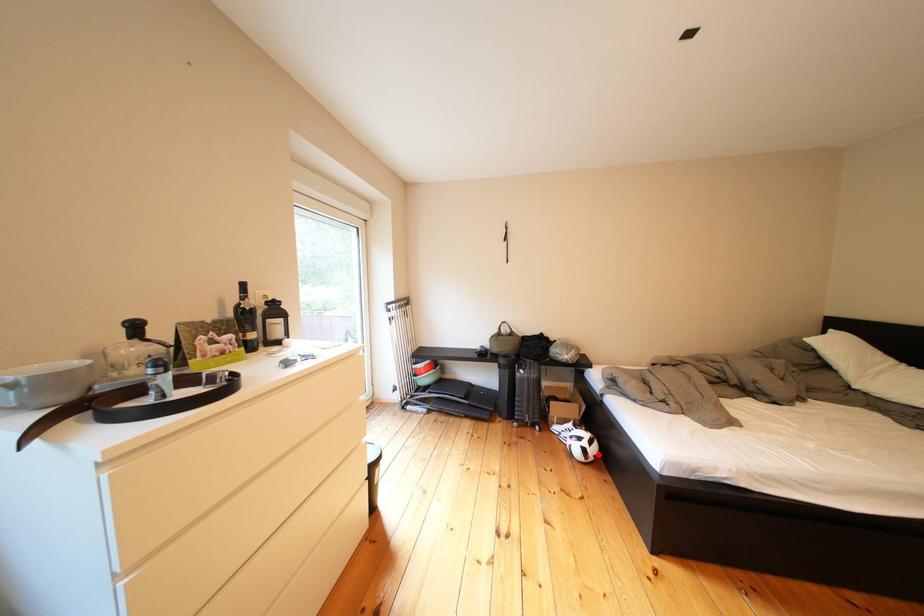
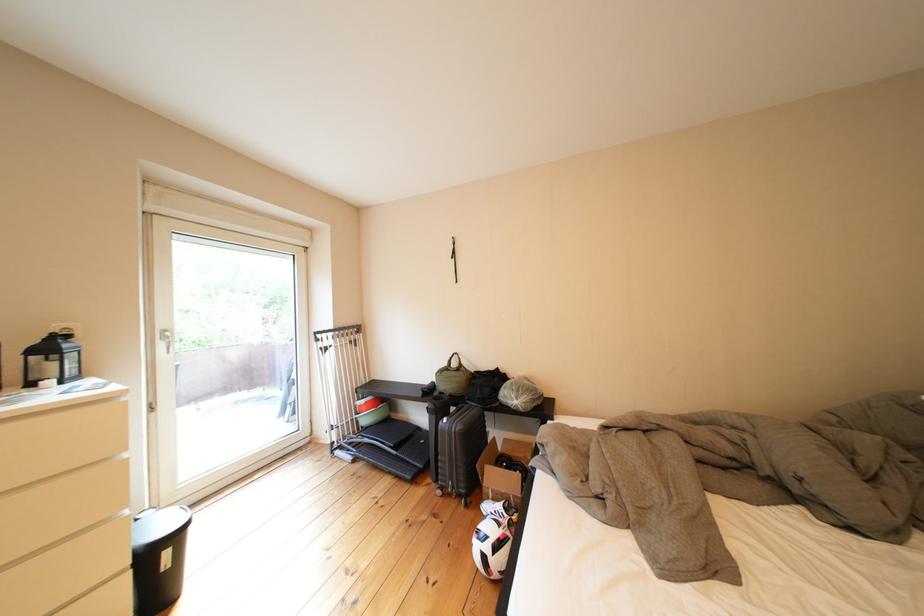
Question: A red point is marked in image1. In image2, is the corresponding 3D point closer to the camera or farther? Reply with the corresponding letter.

Choices:
 (A) The corresponding 3D point is closer.
 (B) The corresponding 3D point is farther.

Answer: (B)